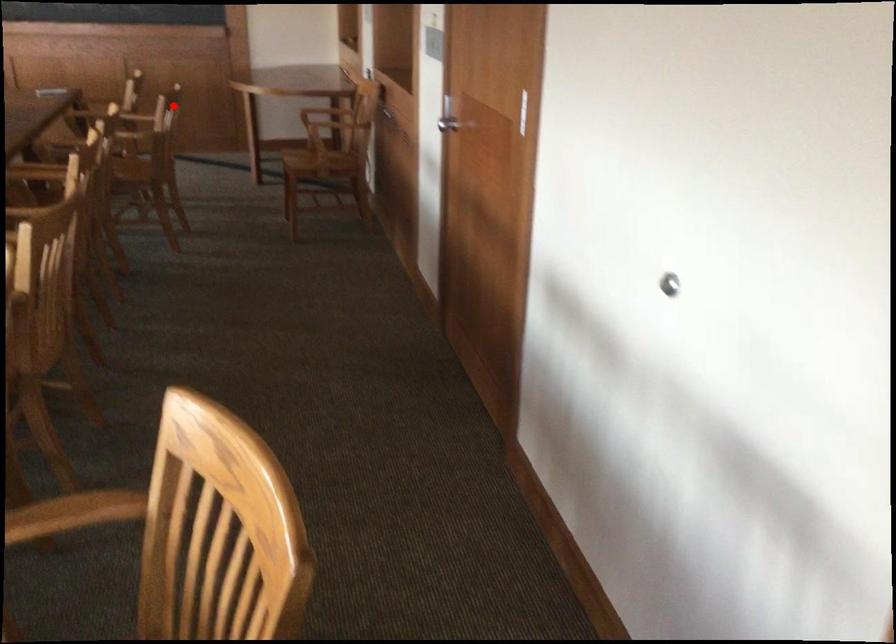
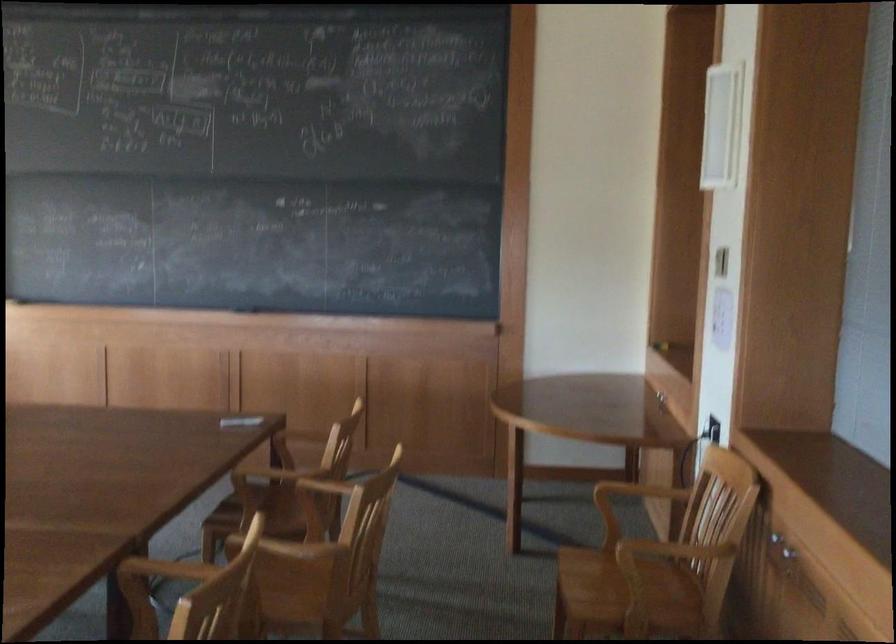
In the second image, find the point that corresponds to the highlighted location in the first image.

(638, 491)